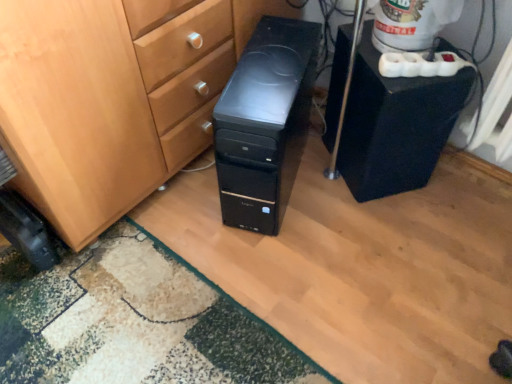
Identify the location of vacant area that is situated to the right of black plastic speaker at right. The height and width of the screenshot is (384, 512). (463, 190).